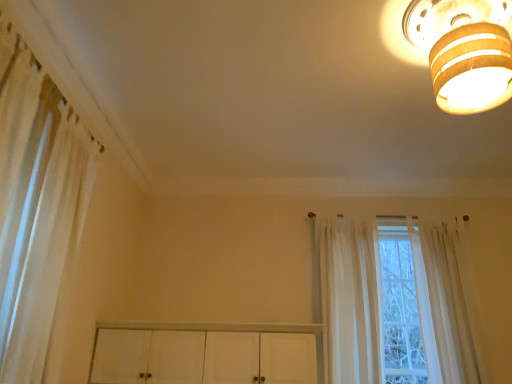
Question: Visually, is wooden ceiling light at upper right positioned to the left or to the right of sheer white curtain at center, positioned as the 2th curtain in left-to-right order?

Choices:
 (A) right
 (B) left

Answer: (A)

Question: Is wooden ceiling light at upper right inside the boundaries of sheer white curtain at center, which appears as the 2th curtain when viewed from the right, or outside?

Choices:
 (A) inside
 (B) outside

Answer: (B)

Question: Which of these objects is positioned farthest from the white sheer curtain at left, placed as the 1th curtain when sorted from left to right?

Choices:
 (A) sheer white curtain at right, which appears as the 3th curtain when viewed from the left
 (B) wooden ceiling light at upper right
 (C) sheer white curtain at center, positioned as the 2th curtain in left-to-right order

Answer: (A)

Question: Considering the real-world distances, which object is farthest from the wooden ceiling light at upper right?

Choices:
 (A) sheer white curtain at center, positioned as the 2th curtain in left-to-right order
 (B) white sheer curtain at left, placed as the 1th curtain when sorted from left to right
 (C) sheer white curtain at right, the 1th curtain from the right

Answer: (B)